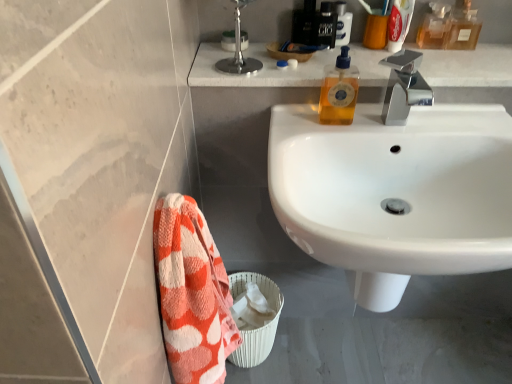
Locate an element on the screen. unoccupied region to the right of yellow liquid soap at upper right, acting as the 1th toiletry starting from the bottom is located at coordinates (409, 115).